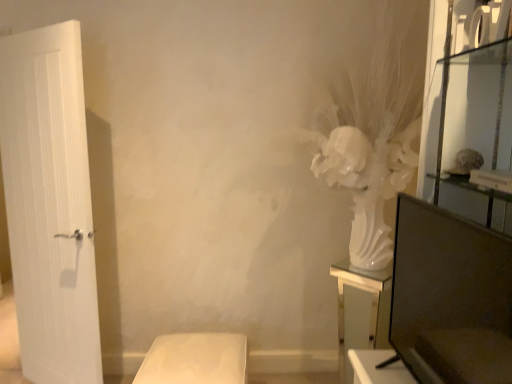
The image size is (512, 384). In order to click on white matte stool at lower center, the 1th furniture in the left-to-right sequence in this screenshot , I will do (x=195, y=359).

This screenshot has width=512, height=384. Describe the element at coordinates (195, 359) in the screenshot. I see `white matte stool at lower center, the 1th furniture in the left-to-right sequence` at that location.

Locate an element on the screen. white glossy vase at right, the first furniture in the right-to-left sequence is located at coordinates (361, 308).

In the scene shown: In order to face white glossy vase at right, which is counted as the 2th furniture, starting from the left, should I rotate leftwards or rightwards?

A 15.132 degree turn to the right will do.

The image size is (512, 384). Describe the element at coordinates (361, 308) in the screenshot. I see `white glossy vase at right, which is counted as the 2th furniture, starting from the left` at that location.

Identify the location of white matte stool at lower center, the 1th furniture in the left-to-right sequence. (195, 359).

Is white glossy vase at right, which is counted as the 2th furniture, starting from the left, at the left side of white matte stool at lower center, the second furniture positioned from the right?

In fact, white glossy vase at right, which is counted as the 2th furniture, starting from the left, is to the right of white matte stool at lower center, the second furniture positioned from the right.

In the image, is white glossy vase at right, which is counted as the 2th furniture, starting from the left, positioned in front of or behind white matte stool at lower center, the second furniture positioned from the right?

white glossy vase at right, which is counted as the 2th furniture, starting from the left, is behind white matte stool at lower center, the second furniture positioned from the right.

Is point (343, 320) positioned after point (208, 377)?

Yes, point (343, 320) is behind point (208, 377).

In the scene shown: From the image's perspective, relative to white matte stool at lower center, the 1th furniture in the left-to-right sequence, is white glossy vase at right, which is counted as the 2th furniture, starting from the left, above or below?

Clearly, from the image's perspective, white glossy vase at right, which is counted as the 2th furniture, starting from the left, is above white matte stool at lower center, the 1th furniture in the left-to-right sequence.

From a real-world perspective, is white glossy vase at right, the first furniture in the right-to-left sequence, physically below white matte stool at lower center, the 1th furniture in the left-to-right sequence?

Actually, white glossy vase at right, the first furniture in the right-to-left sequence, is physically above white matte stool at lower center, the 1th furniture in the left-to-right sequence, in the real world.

Which object is thinner, white glossy vase at right, which is counted as the 2th furniture, starting from the left, or white matte stool at lower center, the 1th furniture in the left-to-right sequence?

white glossy vase at right, which is counted as the 2th furniture, starting from the left, is thinner.

In terms of height, does white glossy vase at right, the first furniture in the right-to-left sequence, look taller or shorter compared to white matte stool at lower center, the 1th furniture in the left-to-right sequence?

white glossy vase at right, the first furniture in the right-to-left sequence, is taller than white matte stool at lower center, the 1th furniture in the left-to-right sequence.

Between white glossy vase at right, which is counted as the 2th furniture, starting from the left, and white matte stool at lower center, the 1th furniture in the left-to-right sequence, which one has larger size?

white matte stool at lower center, the 1th furniture in the left-to-right sequence, is bigger.

Is white matte stool at lower center, the second furniture positioned from the right, completely or partially inside white glossy vase at right, which is counted as the 2th furniture, starting from the left?

No.

Would you say white glossy vase at right, which is counted as the 2th furniture, starting from the left, is a long distance from white matte stool at lower center, the 1th furniture in the left-to-right sequence?

No, white glossy vase at right, which is counted as the 2th furniture, starting from the left, is not far away from white matte stool at lower center, the 1th furniture in the left-to-right sequence.

Is white glossy vase at right, which is counted as the 2th furniture, starting from the left, turned away from white matte stool at lower center, the second furniture positioned from the right?

white glossy vase at right, which is counted as the 2th furniture, starting from the left, does not have its back to white matte stool at lower center, the second furniture positioned from the right.

What's the angular difference between white glossy vase at right, the first furniture in the right-to-left sequence, and white matte stool at lower center, the 1th furniture in the left-to-right sequence,'s facing directions?

There is a 44-degree angle between the facing directions of white glossy vase at right, the first furniture in the right-to-left sequence, and white matte stool at lower center, the 1th furniture in the left-to-right sequence.

How distant is white glossy vase at right, which is counted as the 2th furniture, starting from the left, from white matte stool at lower center, the second furniture positioned from the right?

The distance of white glossy vase at right, which is counted as the 2th furniture, starting from the left, from white matte stool at lower center, the second furniture positioned from the right, is 29.02 inches.

The width and height of the screenshot is (512, 384). I want to click on furniture above the white matte stool at lower center, the second furniture positioned from the right (from a real-world perspective), so click(x=361, y=308).

Does white matte stool at lower center, the 1th furniture in the left-to-right sequence, appear on the right side of white glossy vase at right, the first furniture in the right-to-left sequence?

No, white matte stool at lower center, the 1th furniture in the left-to-right sequence, is not to the right of white glossy vase at right, the first furniture in the right-to-left sequence.

In the image, is white matte stool at lower center, the second furniture positioned from the right, positioned in front of or behind white glossy vase at right, which is counted as the 2th furniture, starting from the left?

white matte stool at lower center, the second furniture positioned from the right, is positioned closer to the viewer than white glossy vase at right, which is counted as the 2th furniture, starting from the left.

Consider the image. Which point is more forward, (187, 367) or (376, 309)?

The point (187, 367) is closer.

From the image's perspective, is white matte stool at lower center, the 1th furniture in the left-to-right sequence, located above white glossy vase at right, which is counted as the 2th furniture, starting from the left?

No, from the image's perspective, white matte stool at lower center, the 1th furniture in the left-to-right sequence, is not on top of white glossy vase at right, which is counted as the 2th furniture, starting from the left.

From a real-world perspective, who is located higher, white matte stool at lower center, the second furniture positioned from the right, or white glossy vase at right, the first furniture in the right-to-left sequence?

white glossy vase at right, the first furniture in the right-to-left sequence, is physically above.

Which of these two, white matte stool at lower center, the 1th furniture in the left-to-right sequence, or white glossy vase at right, which is counted as the 2th furniture, starting from the left, is wider?

Wider between the two is white matte stool at lower center, the 1th furniture in the left-to-right sequence.

Who is taller, white matte stool at lower center, the second furniture positioned from the right, or white glossy vase at right, which is counted as the 2th furniture, starting from the left?

Standing taller between the two is white glossy vase at right, which is counted as the 2th furniture, starting from the left.

Which of these two, white matte stool at lower center, the second furniture positioned from the right, or white glossy vase at right, the first furniture in the right-to-left sequence, is bigger?

white matte stool at lower center, the second furniture positioned from the right.

Does white matte stool at lower center, the second furniture positioned from the right, contain white glossy vase at right, the first furniture in the right-to-left sequence?

Definitely not — white glossy vase at right, the first furniture in the right-to-left sequence, is not inside white matte stool at lower center, the second furniture positioned from the right.

Is white matte stool at lower center, the second furniture positioned from the right, with white glossy vase at right, the first furniture in the right-to-left sequence?

white matte stool at lower center, the second furniture positioned from the right, is not next to white glossy vase at right, the first furniture in the right-to-left sequence, and they're not touching.

Is white matte stool at lower center, the second furniture positioned from the right, aimed at white glossy vase at right, which is counted as the 2th furniture, starting from the left?

No.

This screenshot has width=512, height=384. Identify the location of furniture located behind the white matte stool at lower center, the second furniture positioned from the right. (361, 308).

The image size is (512, 384). Find the location of `furniture behind the white matte stool at lower center, the 1th furniture in the left-to-right sequence`. furniture behind the white matte stool at lower center, the 1th furniture in the left-to-right sequence is located at coordinates (361, 308).

Find the location of a particular element. This screenshot has width=512, height=384. furniture below the white glossy vase at right, which is counted as the 2th furniture, starting from the left (from a real-world perspective) is located at coordinates (195, 359).